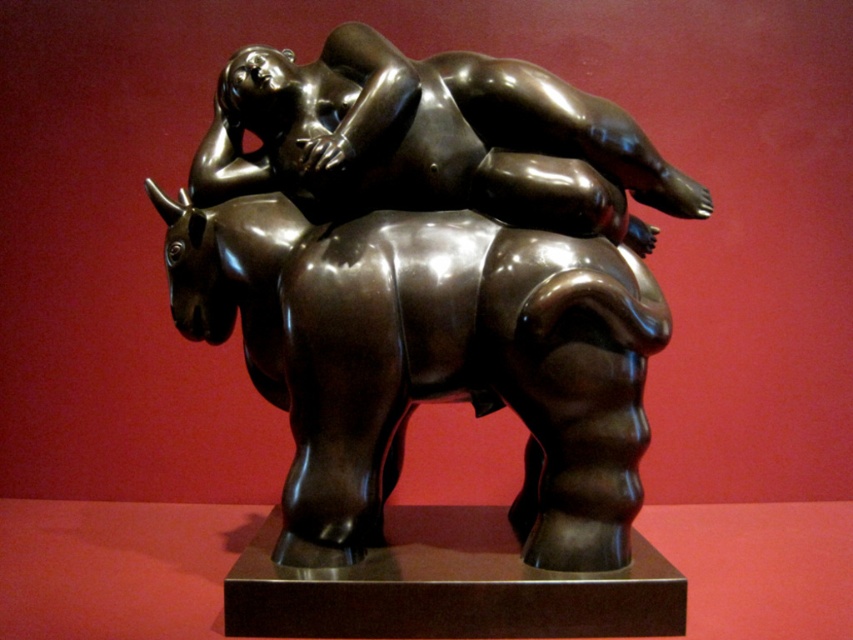
Question: Is shiny bronze statue at center above bronze figure at center?

Choices:
 (A) no
 (B) yes

Answer: (A)

Question: Which object appears closest to the camera in this image?

Choices:
 (A) bronze figure at center
 (B) shiny bronze statue at center

Answer: (A)

Question: Is the position of shiny bronze statue at center less distant than that of bronze figure at center?

Choices:
 (A) no
 (B) yes

Answer: (A)

Question: Does shiny bronze statue at center appear over bronze figure at center?

Choices:
 (A) no
 (B) yes

Answer: (A)

Question: Which of the following is the closest to the observer?

Choices:
 (A) (476, 102)
 (B) (474, 77)

Answer: (B)